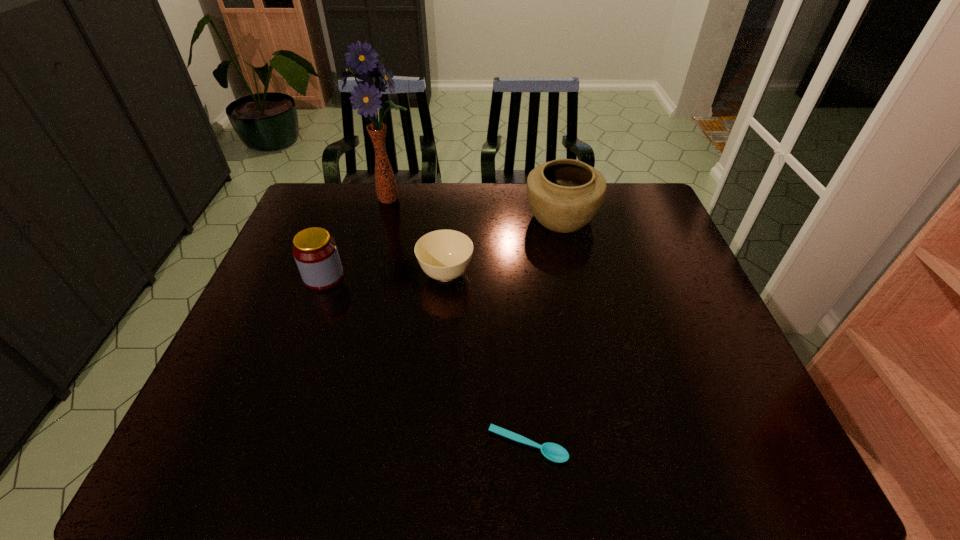
Find the location of a particular element. vacant space at the far right corner is located at coordinates [x=656, y=211].

Identify the location of vacant space that is in between the spoon and the third tallest object. The width and height of the screenshot is (960, 540). (425, 361).

In order to click on free spot between the jar and the fourth tallest object in this screenshot , I will do `click(385, 275)`.

Locate an element on the screen. Image resolution: width=960 pixels, height=540 pixels. free space that is in between the shortest object and the second shortest object is located at coordinates (487, 360).

Locate an element on the screen. vacant space in between the jar and the spoon is located at coordinates (425, 361).

I want to click on free space that is in between the flower arrangement and the third object from right to left, so click(418, 237).

Where is `free space between the third shortest object and the spoon`? The width and height of the screenshot is (960, 540). free space between the third shortest object and the spoon is located at coordinates (425, 361).

The width and height of the screenshot is (960, 540). In order to click on free spot between the third tallest object and the third object from left to right in this screenshot , I will do `click(385, 275)`.

Locate an element on the screen. The image size is (960, 540). free space between the pottery and the flower arrangement is located at coordinates (475, 208).

The height and width of the screenshot is (540, 960). I want to click on empty location between the second tallest object and the flower arrangement, so click(475, 208).